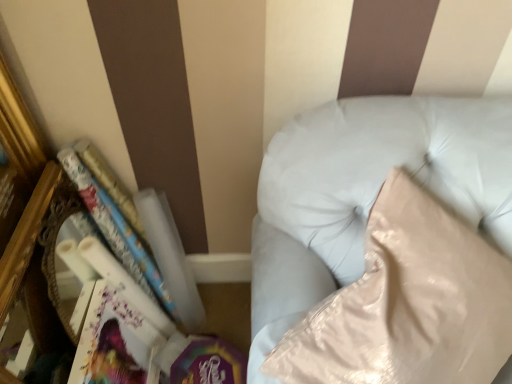
This screenshot has width=512, height=384. What do you see at coordinates (138, 232) in the screenshot? I see `white glossy book at left` at bounding box center [138, 232].

In order to click on white glossy book at left in this screenshot , I will do `click(138, 232)`.

The image size is (512, 384). I want to click on matte white paperback book at lower left, so click(x=116, y=343).

There is a matte white paperback book at lower left. Identify the location of furniture above it (from a real-world perspective). (386, 169).

From the picture: From a real-world perspective, is white leather couch at upper right physically located above or below matte white paperback book at lower left?

white leather couch at upper right is situated higher than matte white paperback book at lower left in the real world.

Consider the image. Is white leather couch at upper right bigger or smaller than matte white paperback book at lower left?

white leather couch at upper right is bigger than matte white paperback book at lower left.

Consider the image. From the image's perspective, relative to matte white paperback book at lower left, is white leather couch at upper right above or below?

Clearly, from the image's perspective, white leather couch at upper right is above matte white paperback book at lower left.

Between matte white paperback book at lower left and white leather couch at upper right, which one has less height?

matte white paperback book at lower left.

Where is `paperback book below the white leather couch at upper right (from the image's perspective)`? The height and width of the screenshot is (384, 512). paperback book below the white leather couch at upper right (from the image's perspective) is located at coordinates (116, 343).

Can you confirm if matte white paperback book at lower left is thinner than white leather couch at upper right?

Correct, the width of matte white paperback book at lower left is less than that of white leather couch at upper right.

Is matte white paperback book at lower left looking in the opposite direction of white leather couch at upper right?

No, matte white paperback book at lower left's orientation is not away from white leather couch at upper right.

In the scene shown: From the image's perspective, is white leather couch at upper right located above or below white glossy book at left?

Based on their image positions, white leather couch at upper right is located beneath white glossy book at left.

Looking at their sizes, would you say white leather couch at upper right is wider or thinner than white glossy book at left?

Considering their sizes, white leather couch at upper right looks broader than white glossy book at left.

Is point (417, 107) closer to viewer compared to point (101, 199)?

That is True.

Is white leather couch at upper right aimed at white glossy book at left?

No, white leather couch at upper right does not turn towards white glossy book at left.

Between white glossy book at left and white leather couch at upper right, which one has larger size?

white leather couch at upper right is bigger.

From a real-world perspective, is white glossy book at left located higher than white leather couch at upper right?

Actually, white glossy book at left is physically below white leather couch at upper right in the real world.

From the picture: Between white glossy book at left and white leather couch at upper right, which one has smaller width?

With smaller width is white glossy book at left.

Which is in front, white glossy book at left or matte white paperback book at lower left?

white glossy book at left is in front.

Based on the photo, could you tell me if white glossy book at left is facing matte white paperback book at lower left?

No, white glossy book at left is not turned towards matte white paperback book at lower left.

From the image's perspective, which is below, white glossy book at left or matte white paperback book at lower left?

matte white paperback book at lower left, from the image's perspective.

Considering the positions of point (95, 182) and point (128, 323), is point (95, 182) closer or farther from the camera than point (128, 323)?

Point (95, 182) is closer to the camera than point (128, 323).

Between matte white paperback book at lower left and white glossy book at left, which one is positioned in front?

white glossy book at left is closer to the camera.

From the picture: Is matte white paperback book at lower left to the left of white glossy book at left from the viewer's perspective?

Correct, you'll find matte white paperback book at lower left to the left of white glossy book at left.

From a real-world perspective, is matte white paperback book at lower left below white glossy book at left?

Yes, from a real-world perspective, matte white paperback book at lower left is under white glossy book at left.

Measure the distance from matte white paperback book at lower left to white glossy book at left.

matte white paperback book at lower left is 7.43 inches from white glossy book at left.

The height and width of the screenshot is (384, 512). I want to click on paperback book that appears below the white leather couch at upper right (from a real-world perspective), so click(x=116, y=343).

The height and width of the screenshot is (384, 512). Identify the location of furniture that appears on the right of matte white paperback book at lower left. (386, 169).

Which object lies further to the anchor point white glossy book at left, white leather couch at upper right or matte white paperback book at lower left?

white leather couch at upper right is further to white glossy book at left.

Estimate the real-world distances between objects in this image. Which object is further from matte white paperback book at lower left, white leather couch at upper right or white glossy book at left?

white leather couch at upper right is further to matte white paperback book at lower left.

Based on the photo, which object lies nearer to the anchor point white glossy book at left, matte white paperback book at lower left or white leather couch at upper right?

Based on the image, matte white paperback book at lower left appears to be nearer to white glossy book at left.

Estimate the real-world distances between objects in this image. Which object is further from matte white paperback book at lower left, white glossy book at left or white leather couch at upper right?

white leather couch at upper right is positioned further to the anchor matte white paperback book at lower left.

Considering their positions, is matte white paperback book at lower left positioned further to white leather couch at upper right than white glossy book at left?

matte white paperback book at lower left is further to white leather couch at upper right.

Considering their positions, is white glossy book at left positioned further to white leather couch at upper right than matte white paperback book at lower left?

matte white paperback book at lower left is positioned further to the anchor white leather couch at upper right.

You are a GUI agent. You are given a task and a screenshot of the screen. Output one action in this format:
    pyautogui.click(x=<x>, y=<y>)
    Task: Click on the book situated between matte white paperback book at lower left and white leather couch at upper right from left to right
    Image resolution: width=512 pixels, height=384 pixels.
    Given the screenshot: What is the action you would take?
    pyautogui.click(x=138, y=232)